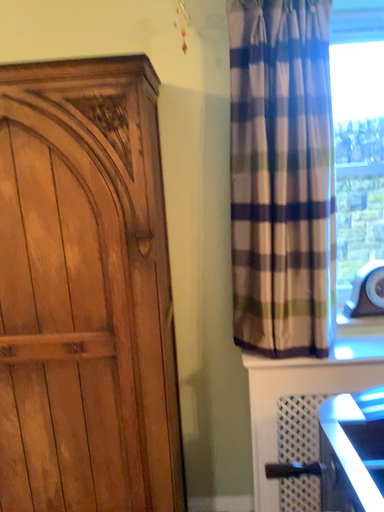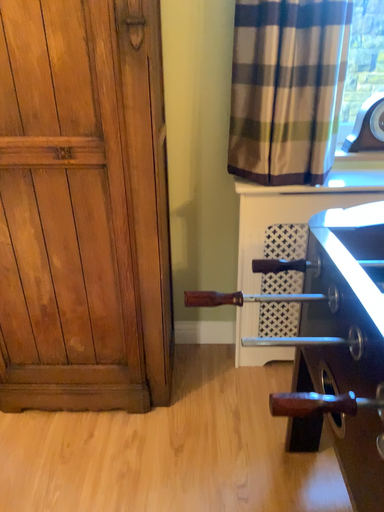
Question: Which way did the camera rotate in the video?

Choices:
 (A) rotated upward
 (B) rotated downward

Answer: (B)